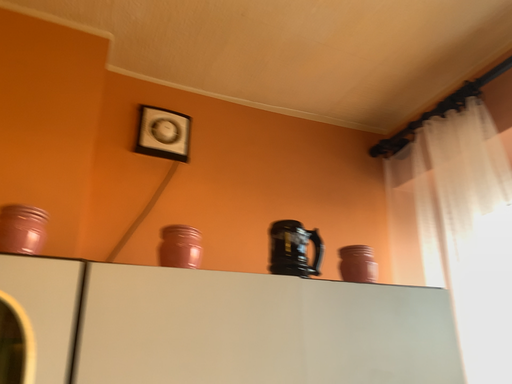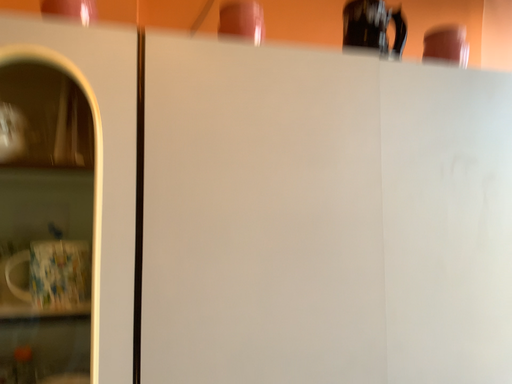
Question: Which way did the camera rotate in the video?

Choices:
 (A) rotated downward
 (B) rotated upward

Answer: (A)